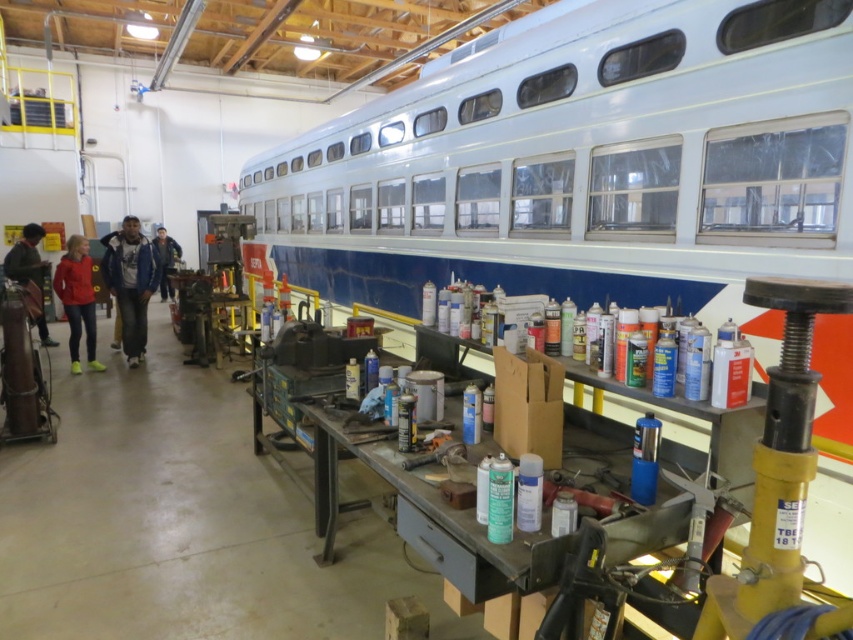
Measure the distance between blue jeans at center and metallic silver tool at center.

blue jeans at center and metallic silver tool at center are 8.47 meters apart from each other.

Can you confirm if blue jeans at center is positioned below metallic silver tool at center?

Actually, blue jeans at center is above metallic silver tool at center.

Is point (166, 291) closer to viewer compared to point (444, 452)?

No, (166, 291) is further to viewer.

At what (x,y) coordinates should I click in order to perform the action: click on blue jeans at center. Please return your answer as a coordinate pair (x, y). Looking at the image, I should click on (165, 260).

Does matte black jacket at left appear on the right side of metallic silver tool at center?

In fact, matte black jacket at left is to the left of metallic silver tool at center.

Is matte black jacket at left shorter than metallic silver tool at center?

No.

Who is more forward, (x=39, y=260) or (x=416, y=461)?

Point (x=416, y=461) is more forward.

Where is `matte black jacket at left`? The height and width of the screenshot is (640, 853). matte black jacket at left is located at coordinates (26, 257).

Measure the distance between point (x=155, y=276) and camera.

Point (x=155, y=276) is 8.30 meters away from camera.

Who is more distant from viewer, (119, 321) or (422, 456)?

The point (119, 321) is more distant.

Where is `blue denim jacket at center`? This screenshot has height=640, width=853. blue denim jacket at center is located at coordinates (129, 284).